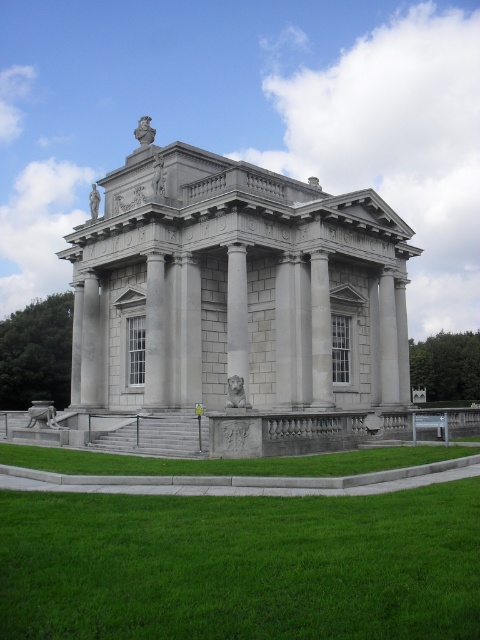
You are standing at the base of the classical structure and want to place a 10 feet wide decorative fountain between the green grass at lower center and the slate gray stone column at center. Is there enough space for the fountain?

The green grass at lower center is 43.66 feet away from the slate gray stone column at center. Since the fountain is only 10 feet wide, there is ample space to place it between them.

You are a gardener who needs to mow the lawn. You see the green grass at lower center and the slate gray stone column at center. Which one is shorter?

The green grass at lower center has a lesser height compared to the slate gray stone column at center, so the green grass at lower center is shorter.

You are standing in front of the classical building and want to walk towards the slate gray stone column at center. Which direction should you move relative to the green grass at lower center?

Since the green grass at lower center is in front of the slate gray stone column at center, you should move towards the green grass at lower center to reach the column.